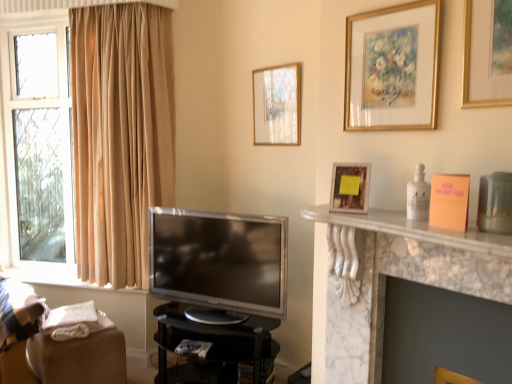
Question: Is wooden photo frame at upper right, arranged as the 2th picture frame when viewed from the right, beside white marble fireplace at right?

Choices:
 (A) no
 (B) yes

Answer: (A)

Question: Is wooden photo frame at upper right, marked as the second picture frame in a left-to-right arrangement, not inside white marble fireplace at right?

Choices:
 (A) yes
 (B) no

Answer: (A)

Question: Considering the relative sizes of wooden photo frame at upper right, arranged as the second picture frame when viewed from the front, and white marble fireplace at right in the image provided, is wooden photo frame at upper right, arranged as the second picture frame when viewed from the front, shorter than white marble fireplace at right?

Choices:
 (A) yes
 (B) no

Answer: (B)

Question: Can you confirm if wooden photo frame at upper right, arranged as the 2th picture frame when viewed from the right, is positioned to the left of white marble fireplace at right?

Choices:
 (A) yes
 (B) no

Answer: (A)

Question: Can you confirm if wooden photo frame at upper right, which appears as the 2th picture frame when viewed from the back, is taller than white marble fireplace at right?

Choices:
 (A) no
 (B) yes

Answer: (B)

Question: From the image's perspective, would you say wooden photo frame at upper right, which appears as the 2th picture frame when viewed from the back, is positioned over white marble fireplace at right?

Choices:
 (A) no
 (B) yes

Answer: (B)

Question: Is wooden photo frame at upper right, marked as the second picture frame in a left-to-right arrangement, further to the viewer compared to matte gold picture frame at upper center, which ranks as the first picture frame in back-to-front order?

Choices:
 (A) yes
 (B) no

Answer: (B)

Question: Is matte gold picture frame at upper center, which ranks as the first picture frame in back-to-front order, completely or partially inside wooden photo frame at upper right, which appears as the 2th picture frame when viewed from the back?

Choices:
 (A) no
 (B) yes

Answer: (A)

Question: Is wooden photo frame at upper right, which appears as the 2th picture frame when viewed from the back, wider than matte gold picture frame at upper center, arranged as the third picture frame when viewed from the right?

Choices:
 (A) yes
 (B) no

Answer: (A)

Question: From a real-world perspective, is wooden photo frame at upper right, arranged as the second picture frame when viewed from the front, beneath matte gold picture frame at upper center, which ranks as the first picture frame in back-to-front order?

Choices:
 (A) yes
 (B) no

Answer: (A)

Question: Is wooden photo frame at upper right, marked as the second picture frame in a left-to-right arrangement, at the left side of matte gold picture frame at upper center, which ranks as the first picture frame in back-to-front order?

Choices:
 (A) yes
 (B) no

Answer: (B)

Question: Considering the relative sizes of wooden photo frame at upper right, marked as the second picture frame in a left-to-right arrangement, and matte gold picture frame at upper center, arranged as the third picture frame when viewed from the right, in the image provided, is wooden photo frame at upper right, marked as the second picture frame in a left-to-right arrangement, taller than matte gold picture frame at upper center, arranged as the third picture frame when viewed from the right,?

Choices:
 (A) no
 (B) yes

Answer: (A)

Question: Is gold-framed painting at upper center, positioned as the third picture frame in back-to-front order, closer to the viewer compared to wooden photo frame at upper right, which appears as the 2th picture frame when viewed from the back?

Choices:
 (A) yes
 (B) no

Answer: (A)